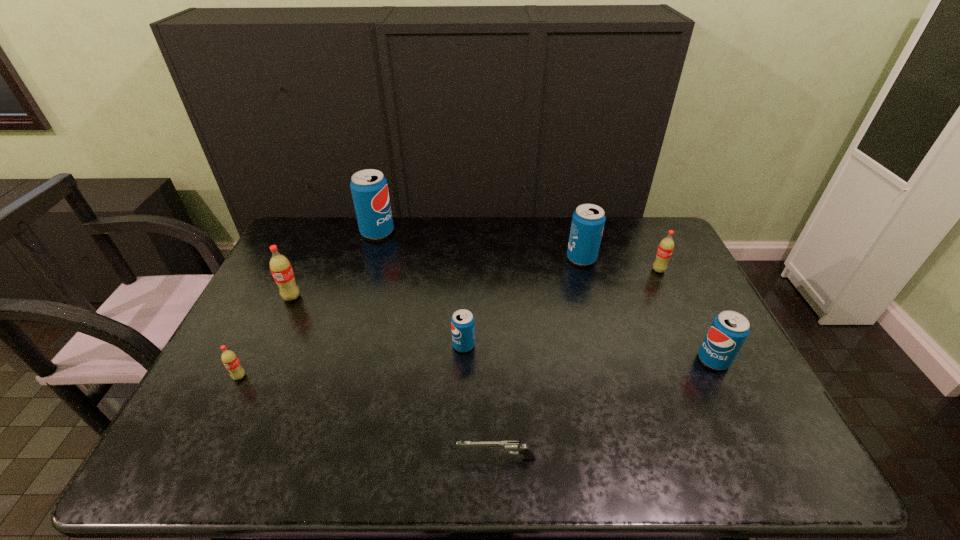
This screenshot has height=540, width=960. Find the location of `free space located 0.140m on the back of the smallest red soda`. free space located 0.140m on the back of the smallest red soda is located at coordinates (262, 331).

Locate an element on the screen. The height and width of the screenshot is (540, 960). blank space located 0.050m on the front-facing side of the nearest object is located at coordinates (435, 458).

Find the location of a particular element. free space located 0.060m on the front-facing side of the nearest object is located at coordinates click(x=430, y=458).

This screenshot has width=960, height=540. In order to click on vacant area situated 0.060m on the front-facing side of the nearest object in this screenshot , I will do `click(430, 458)`.

This screenshot has height=540, width=960. In order to click on object that is at the near edge in this screenshot , I will do `click(509, 446)`.

What are the coordinates of `vacant space at the far edge` in the screenshot? It's located at (609, 221).

Identify the location of vacant space at the near edge. Image resolution: width=960 pixels, height=540 pixels. (x=310, y=462).

Where is `free space at the left edge of the desktop`? This screenshot has width=960, height=540. free space at the left edge of the desktop is located at coordinates (217, 372).

In the image, there is a desktop. Where is `vacant space at the right edge`? Image resolution: width=960 pixels, height=540 pixels. vacant space at the right edge is located at coordinates (732, 394).

Image resolution: width=960 pixels, height=540 pixels. What are the coordinates of `vacant space at the far left corner of the desktop` in the screenshot? It's located at (320, 255).